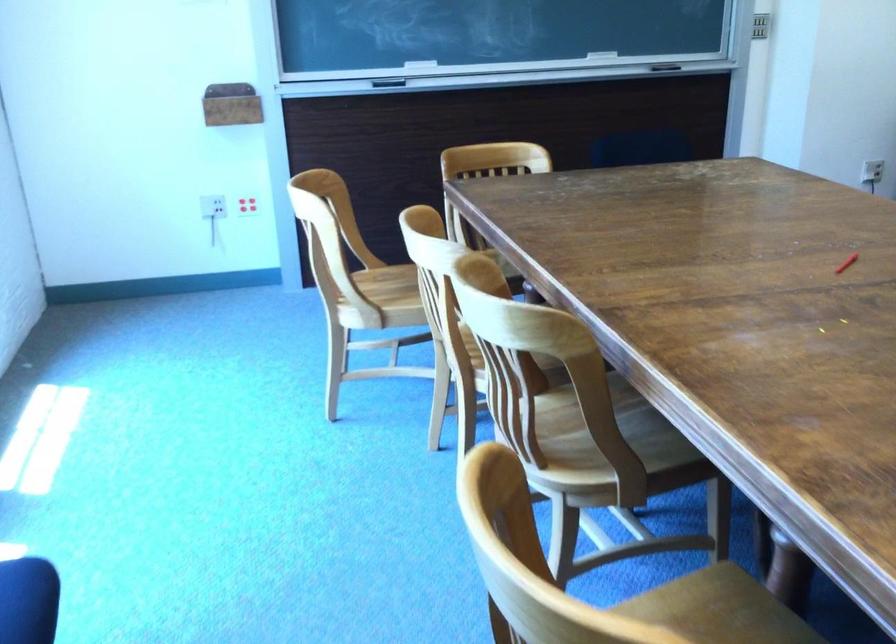
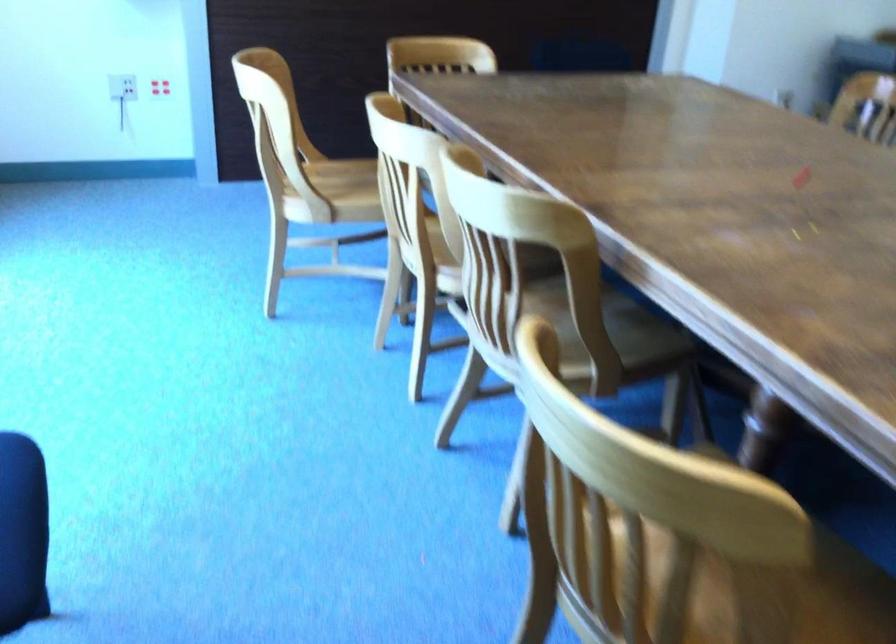
In the second image, find the point that corresponds to (255,207) in the first image.

(159, 87)